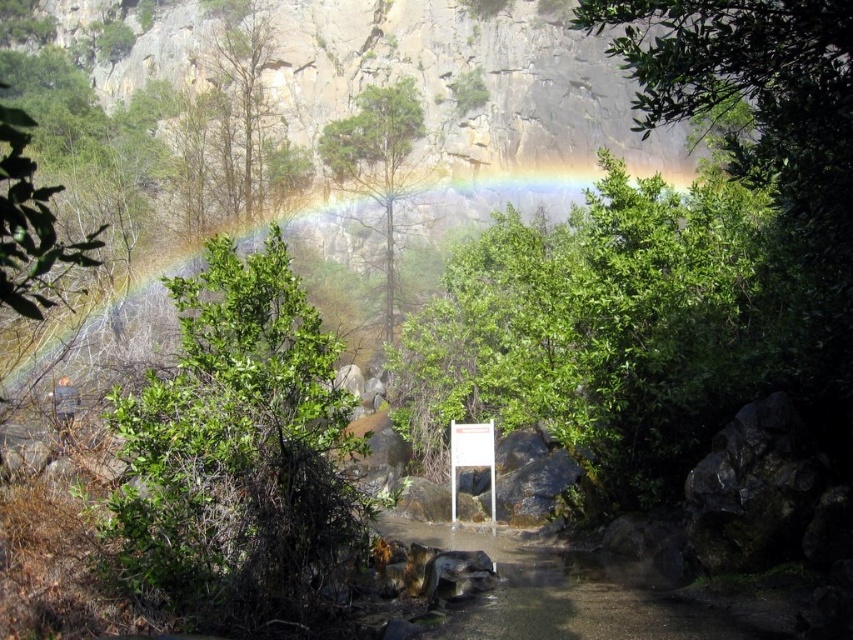
Question: Which object appears closest to the camera in this image?

Choices:
 (A) rainbow at upper center
 (B) green matte tree at center
 (C) white paper at center

Answer: (A)

Question: Which point appears farthest from the camera in this image?

Choices:
 (A) (408, 120)
 (B) (482, 465)
 (C) (317, 410)
 (D) (416, 252)

Answer: (A)

Question: From the image, what is the correct spatial relationship of green leafy bush at left in relation to white paper at center?

Choices:
 (A) left
 (B) right

Answer: (A)

Question: Is rainbow at upper center wider than white paper at center?

Choices:
 (A) no
 (B) yes

Answer: (B)

Question: Which point is farther to the camera?

Choices:
 (A) green leafy bush at left
 (B) white paper at center
 (C) green matte tree at center
 (D) rainbow at upper center

Answer: (C)

Question: Is green leafy bush at left positioned in front of rainbow at upper center?

Choices:
 (A) no
 (B) yes

Answer: (B)